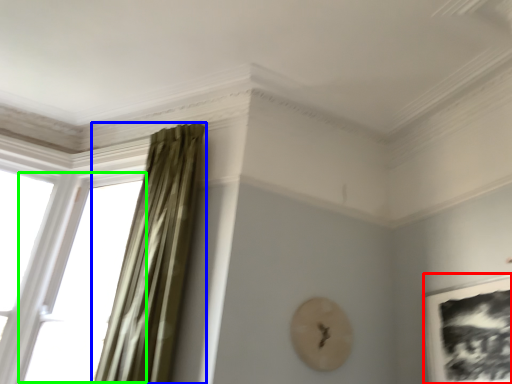
Question: Which object is positioned closest to picture frame (highlighted by a red box)? Select from curtain (highlighted by a blue box) and window (highlighted by a green box).

Choices:
 (A) curtain
 (B) window

Answer: (A)